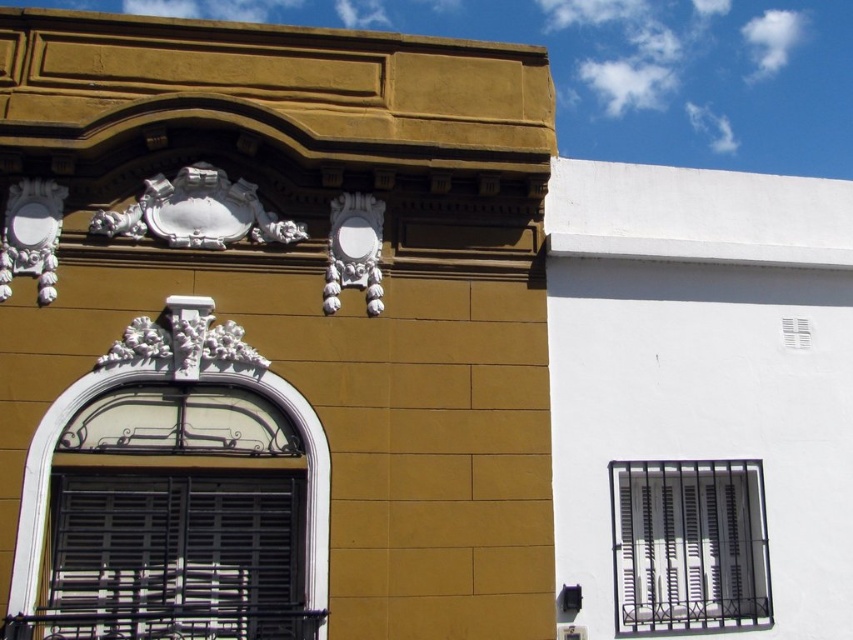
Question: Which point is farther to the camera?

Choices:
 (A) (763, 612)
 (B) (322, 456)

Answer: (A)

Question: Does metallic gray bars at center have a greater width compared to white matte window at center?

Choices:
 (A) no
 (B) yes

Answer: (A)

Question: Is the position of metallic gray bars at center more distant than that of white matte window at center?

Choices:
 (A) yes
 (B) no

Answer: (A)

Question: Among these objects, which one is farthest from the camera?

Choices:
 (A) metallic gray bars at center
 (B) white matte window at center

Answer: (A)

Question: Is metallic gray bars at center positioned in front of white matte window at center?

Choices:
 (A) yes
 (B) no

Answer: (B)

Question: Which point is farther to the camera?

Choices:
 (A) (320, 508)
 (B) (624, 602)

Answer: (B)